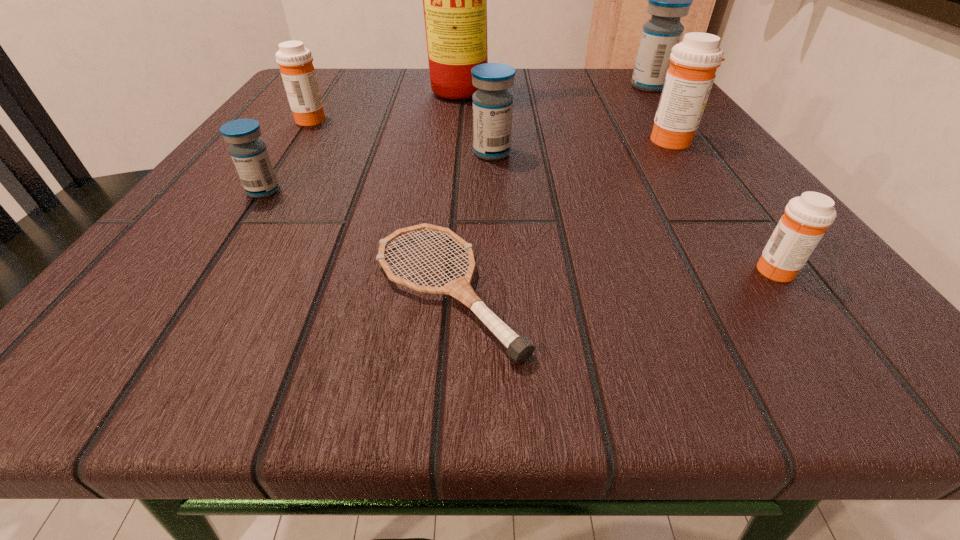
Locate an element on the screen. This screenshot has width=960, height=540. empty space that is in between the leftmost orange medicine and the second nearest medicine is located at coordinates (286, 155).

Image resolution: width=960 pixels, height=540 pixels. In order to click on free space between the third medicine from left to right and the nearest orange medicine in this screenshot , I will do point(634,211).

The image size is (960, 540). Find the location of `vacant space in between the nearest medicine and the gray tennis racket`. vacant space in between the nearest medicine and the gray tennis racket is located at coordinates (612, 280).

Choose which object is the sixth nearest neighbor to the sixth farthest object. Please provide its 2D coordinates. Your answer should be formatted as a tuple, i.e. [(x, y)], where the tuple contains the x and y coordinates of a point satisfying the conditions above.

[(806, 218)]

Locate which object is the fifth closest to the second smallest orange medicine. Please provide its 2D coordinates. Your answer should be formatted as a tuple, i.e. [(x, y)], where the tuple contains the x and y coordinates of a point satisfying the conditions above.

[(689, 79)]

Identify which medicine is the third nearest to the second blue medicine from left to right. Please provide its 2D coordinates. Your answer should be formatted as a tuple, i.e. [(x, y)], where the tuple contains the x and y coordinates of a point satisfying the conditions above.

[(250, 156)]

Locate which medicine ranks in proximity to the biggest blue medicine. Please provide its 2D coordinates. Your answer should be formatted as a tuple, i.e. [(x, y)], where the tuple contains the x and y coordinates of a point satisfying the conditions above.

[(689, 79)]

Where is `blue medicine that stands as the third closest to the fire extinguisher`? The image size is (960, 540). blue medicine that stands as the third closest to the fire extinguisher is located at coordinates pyautogui.click(x=250, y=156).

Locate an element on the screen. The height and width of the screenshot is (540, 960). blue medicine that is the second closest to the leftmost orange medicine is located at coordinates (492, 104).

I want to click on orange medicine that can be found as the second closest to the leftmost orange medicine, so click(x=806, y=218).